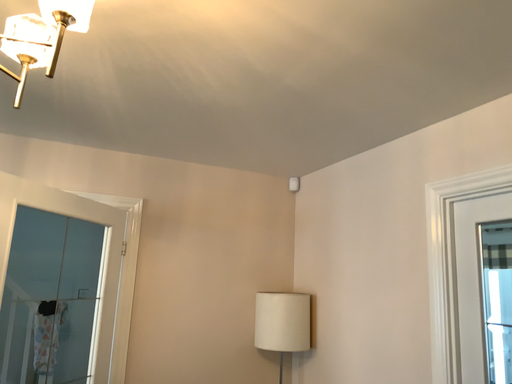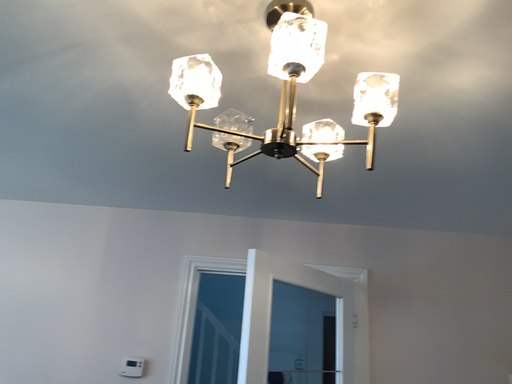
Question: How did the camera likely rotate when shooting the video?

Choices:
 (A) rotated left
 (B) rotated right

Answer: (A)